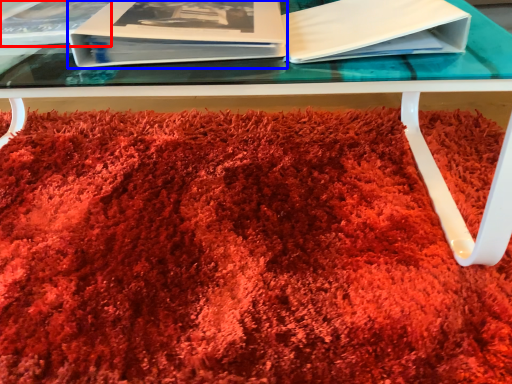
Question: Which object appears closest to the camera in this image, album (highlighted by a red box) or paperback book (highlighted by a blue box)?

Choices:
 (A) album
 (B) paperback book

Answer: (B)